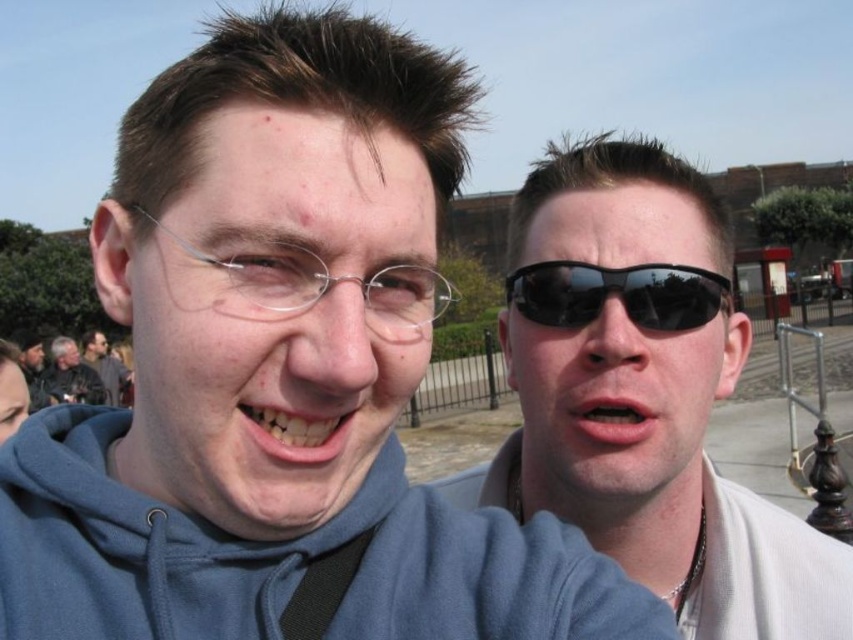
Question: Which object is farther from the camera taking this photo?

Choices:
 (A) teeth glossy at center
 (B) sunglasses at right

Answer: (B)

Question: Which object appears farthest from the camera in this image?

Choices:
 (A) black plastic sunglasses at center
 (B) pink matte lips at center
 (C) matte gray hoodie at left

Answer: (C)

Question: Which of the following is the closest to the observer?

Choices:
 (A) (722, 365)
 (B) (9, 371)
 (C) (566, 324)

Answer: (C)

Question: Can you confirm if black plastic sunglasses at center is positioned to the right of matte blue hoodie at lower left?

Choices:
 (A) yes
 (B) no

Answer: (A)

Question: Where is matte plastic glasses at center located in relation to matte black jacket at left in the image?

Choices:
 (A) below
 (B) above

Answer: (B)

Question: Does matte plastic glasses at center have a larger size compared to matte blue hoodie at lower left?

Choices:
 (A) no
 (B) yes

Answer: (A)